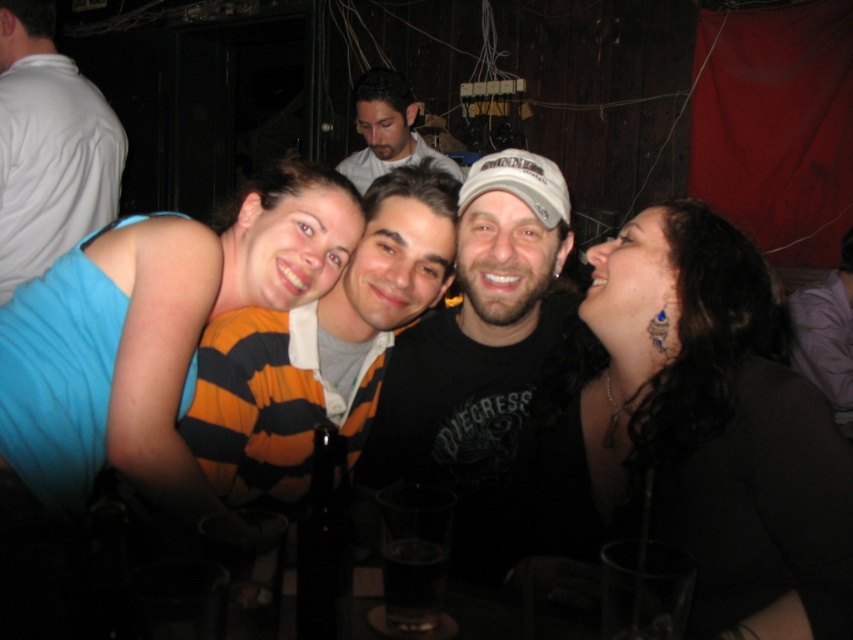
Question: Among these objects, which one is nearest to the camera?

Choices:
 (A) smooth gray shirt at center
 (B) black matte hair at upper right

Answer: (B)

Question: Can you confirm if black matte t-shirt at center is bigger than striped sweater at center?

Choices:
 (A) no
 (B) yes

Answer: (B)

Question: Is blue fabric tank top at upper left wider than purple fabric shirt at right?

Choices:
 (A) yes
 (B) no

Answer: (A)

Question: Considering the real-world distances, which object is closest to the purple fabric shirt at right?

Choices:
 (A) striped sweater at center
 (B) black matte t-shirt at center
 (C) smooth gray shirt at center
 (D) black matte hair at upper right

Answer: (C)

Question: Which of these objects is positioned closest to the blue fabric tank top at upper left?

Choices:
 (A) purple fabric shirt at right
 (B) smooth gray shirt at center
 (C) striped sweater at center

Answer: (C)

Question: Is black matte hair at upper right thinner than white matte shirt at upper left?

Choices:
 (A) yes
 (B) no

Answer: (B)